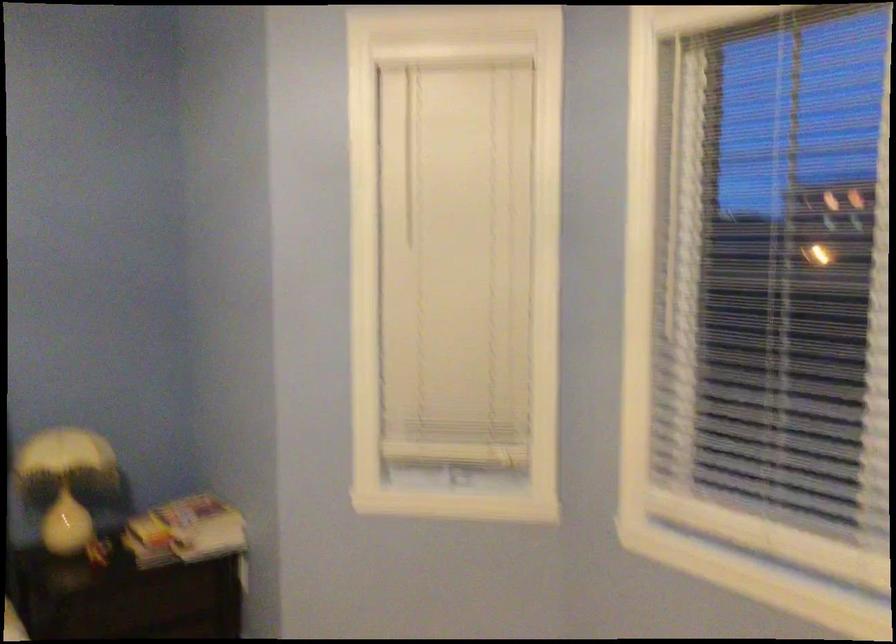
Where would you lift the stack of magazines? Please return your answer as a coordinate pair (x, y).

(185, 532)